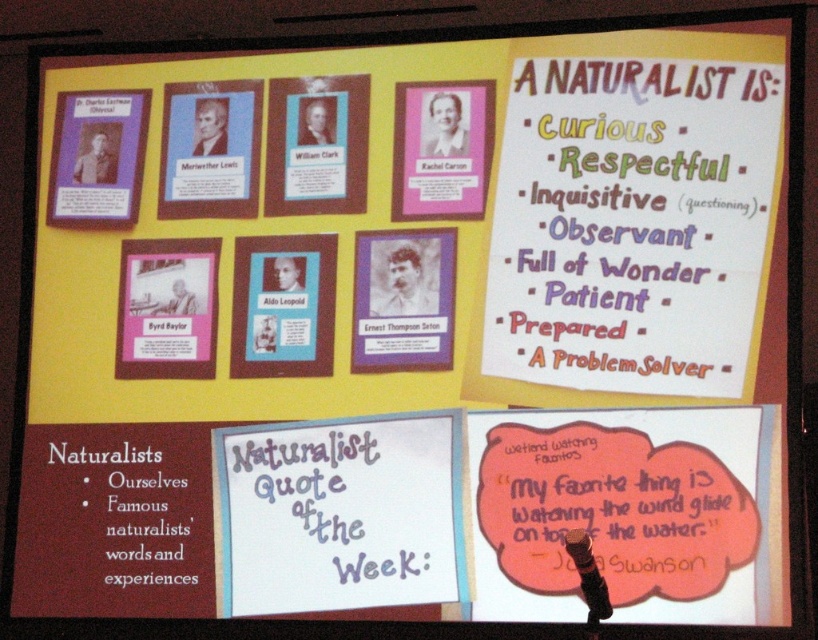
You are looking at an educational poster about naturalists. The poster has an orange paper quote at lower right and a purple paper at center. Which object is positioned more to the east side of the poster?

The orange paper quote at lower right is positioned to the east side of the poster because it is to the right of the purple paper at center.

You are a student looking at the educational poster about naturalists. You notice the orange paper quote at lower right and the purple paper at center. Which one is positioned higher on the poster?

The orange paper quote at lower right is located above the purple paper at center, so it is positioned higher on the poster.